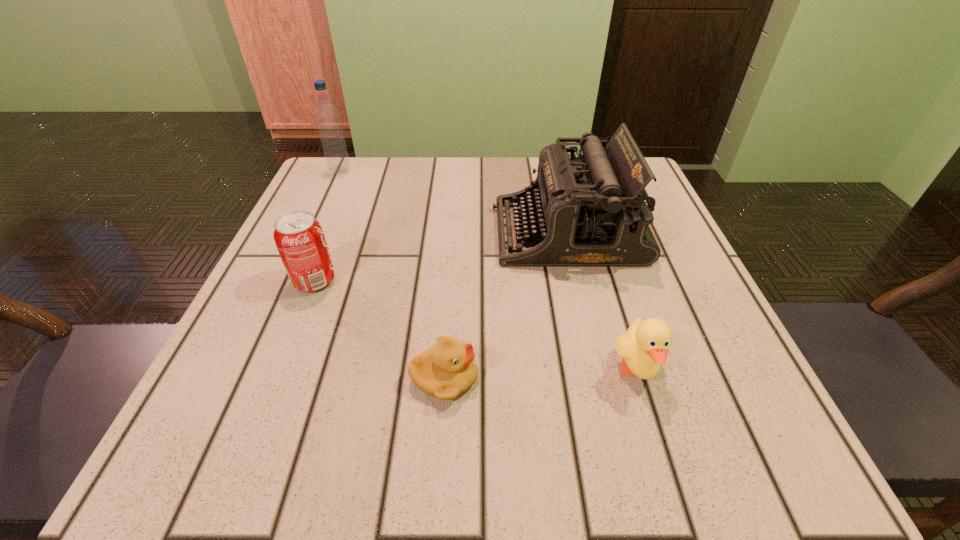
Choose which object is the nearest neighbor to the taller duckling. Please provide its 2D coordinates. Your answer should be formatted as a tuple, i.e. [(x, y)], where the tuple contains the x and y coordinates of a point satisfying the conditions above.

[(589, 211)]

Where is `the second closest object relative to the taller duckling`? The width and height of the screenshot is (960, 540). the second closest object relative to the taller duckling is located at coordinates (447, 369).

I want to click on blank space that satisfies the following two spatial constraints: 1. on the front-facing side of the right duckling; 2. at the beak of the shortest object, so click(x=639, y=378).